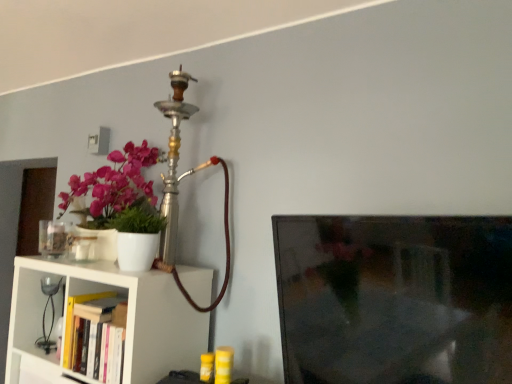
This screenshot has height=384, width=512. In order to click on white matte shelf at lower left in this screenshot , I will do `click(127, 316)`.

This screenshot has width=512, height=384. In order to click on white matte shelf at lower left in this screenshot , I will do click(127, 316).

Who is smaller, black glass table lamp at left or white matte shelf at lower left?

black glass table lamp at left is smaller.

From the image's perspective, would you say black glass table lamp at left is positioned over white matte shelf at lower left?

Yes, from the image's perspective, black glass table lamp at left is on top of white matte shelf at lower left.

Is black glass table lamp at left shorter than white matte shelf at lower left?

Yes, black glass table lamp at left is shorter than white matte shelf at lower left.

Is black glass table lamp at left positioned before hardcover book at lower left?

No, black glass table lamp at left is further to the viewer.

Considering the sizes of black glass table lamp at left and hardcover book at lower left in the image, is black glass table lamp at left wider or thinner than hardcover book at lower left?

Considering their sizes, black glass table lamp at left looks slimmer than hardcover book at lower left.

Would you say black glass table lamp at left contains hardcover book at lower left?

No, hardcover book at lower left is located outside of black glass table lamp at left.

Considering the relative positions of black glass table lamp at left and hardcover book at lower left in the image provided, is black glass table lamp at left to the right of hardcover book at lower left from the viewer's perspective?

No, black glass table lamp at left is not to the right of hardcover book at lower left.

From the picture: Can you tell me how much hardcover book at lower left and black glass table lamp at left differ in facing direction?

0.00111 degrees.

Considering the relative sizes of hardcover book at lower left and black glass table lamp at left in the image provided, is hardcover book at lower left thinner than black glass table lamp at left?

In fact, hardcover book at lower left might be wider than black glass table lamp at left.

From the picture: Looking at the image, does hardcover book at lower left seem bigger or smaller compared to black glass table lamp at left?

In the image, hardcover book at lower left appears to be smaller than black glass table lamp at left.

From the image's perspective, which is below, hardcover book at lower left or black glass table lamp at left?

hardcover book at lower left.

How many degrees apart are the facing directions of white matte shelf at lower left and hardcover book at lower left?

1.9 degrees.

Is white matte shelf at lower left positioned before hardcover book at lower left?

Yes, it is in front of hardcover book at lower left.

Does white matte shelf at lower left touch hardcover book at lower left?

There is a gap between white matte shelf at lower left and hardcover book at lower left.

Is white matte shelf at lower left not within black glass table lamp at left?

Absolutely, white matte shelf at lower left is external to black glass table lamp at left.

Considering the sizes of objects white matte shelf at lower left and black glass table lamp at left in the image provided, who is taller, white matte shelf at lower left or black glass table lamp at left?

With more height is white matte shelf at lower left.

From a real-world perspective, relative to black glass table lamp at left, is white matte shelf at lower left vertically above or below?

white matte shelf at lower left is situated lower than black glass table lamp at left in the real world.

Is white matte shelf at lower left aimed at black glass table lamp at left?

Yes, white matte shelf at lower left is aimed at black glass table lamp at left.

Who is bigger, hardcover book at lower left or white matte shelf at lower left?

Bigger between the two is white matte shelf at lower left.

From the image's perspective, is hardcover book at lower left on top of white matte shelf at lower left?

Yes, from the image's perspective, hardcover book at lower left is above white matte shelf at lower left.

Which point is more forward, (105,316) or (14,298)?

The point (105,316) is more forward.

How much distance is there between hardcover book at lower left and white matte shelf at lower left?

The distance of hardcover book at lower left from white matte shelf at lower left is 5.59 inches.

There is a white matte shelf at lower left. In order to click on table lamp above it (from a real-world perspective) in this screenshot , I will do `click(45, 312)`.

At what (x,y) coordinates should I click in order to perform the action: click on book in front of the black glass table lamp at left. Please return your answer as a coordinate pair (x, y). This screenshot has width=512, height=384. Looking at the image, I should click on (95, 336).

Estimate the real-world distances between objects in this image. Which object is closer to white matte shelf at lower left, hardcover book at lower left or black glass table lamp at left?

hardcover book at lower left.

Looking at the image, which one is located further to white matte shelf at lower left, black glass table lamp at left or hardcover book at lower left?

black glass table lamp at left is further to white matte shelf at lower left.

Estimate the real-world distances between objects in this image. Which object is further from hardcover book at lower left, black glass table lamp at left or white matte shelf at lower left?

black glass table lamp at left is positioned further to the anchor hardcover book at lower left.

From the picture: Estimate the real-world distances between objects in this image. Which object is further from black glass table lamp at left, white matte shelf at lower left or hardcover book at lower left?

Among the two, hardcover book at lower left is located further to black glass table lamp at left.

When comparing their distances from black glass table lamp at left, does hardcover book at lower left or white matte shelf at lower left seem closer?

white matte shelf at lower left lies closer to black glass table lamp at left than the other object.

Based on their spatial positions, is white matte shelf at lower left or black glass table lamp at left closer to hardcover book at lower left?

white matte shelf at lower left.

Find the location of a particular element. The height and width of the screenshot is (384, 512). book between white matte shelf at lower left and black glass table lamp at left along the z-axis is located at coordinates (95, 336).